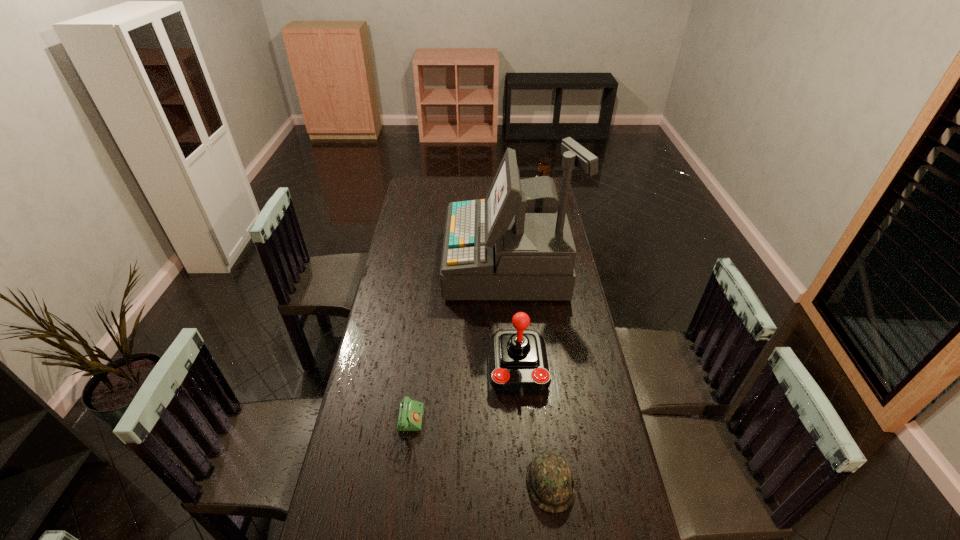
The width and height of the screenshot is (960, 540). In order to click on object identified as the closest to the lantern in this screenshot , I will do `click(516, 244)`.

Identify which object is the nearest to the fourth nearest object. Please provide its 2D coordinates. Your answer should be formatted as a tuple, i.e. [(x, y)], where the tuple contains the x and y coordinates of a point satisfying the conditions above.

[(518, 365)]

Where is `free space that satisfies the following two spatial constraints: 1. on the side of the farthest object, there is a wick adjustment knob; 2. on the base of the joystick`? The image size is (960, 540). free space that satisfies the following two spatial constraints: 1. on the side of the farthest object, there is a wick adjustment knob; 2. on the base of the joystick is located at coordinates (574, 369).

Find the location of a particular element. The width and height of the screenshot is (960, 540). free spot that satisfies the following two spatial constraints: 1. on the customer-facing side of the cash register; 2. on the left side of the headwear is located at coordinates (525, 483).

Identify the location of free point that satisfies the following two spatial constraints: 1. on the back side of the second shortest object; 2. on the customer-facing side of the cash register. (524, 264).

This screenshot has height=540, width=960. I want to click on blank space that satisfies the following two spatial constraints: 1. on the base of the joystick; 2. on the dial of the leftmost object, so click(x=523, y=433).